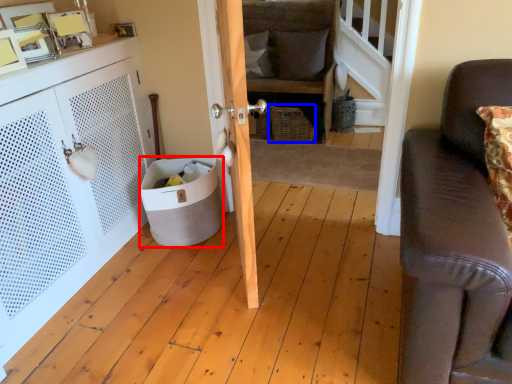
Question: Which object is further to the camera taking this photo, trash bin/can (highlighted by a red box) or basket (highlighted by a blue box)?

Choices:
 (A) trash bin/can
 (B) basket

Answer: (B)